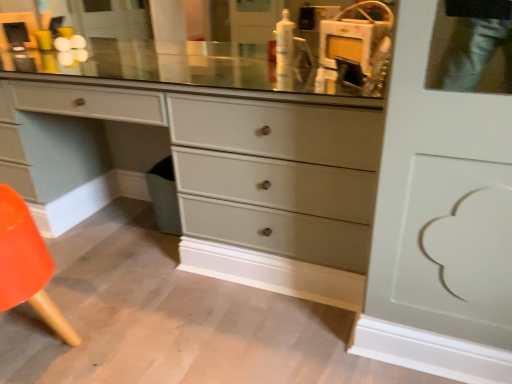
Image resolution: width=512 pixels, height=384 pixels. Identify the location of matte gray dresser at center. (249, 180).

You are a GUI agent. You are given a task and a screenshot of the screen. Output one action in this format:
    pyautogui.click(x=<x>, y=<y>)
    Task: Click on the orange plastic chair at lower left
    
    Given the screenshot: What is the action you would take?
    pyautogui.click(x=27, y=265)

This screenshot has height=384, width=512. I want to click on matte gray dresser at center, so click(249, 180).

Is matte gray dresser at center directly adjacent to white glossy lotion at upper center?

matte gray dresser at center and white glossy lotion at upper center are clearly separated.

The image size is (512, 384). Identify the location of chest of drawers that is on the left side of white glossy lotion at upper center. (249, 180).

Does point (147, 144) appear closer or farther from the camera than point (283, 11)?

Point (147, 144) is positioned closer to the camera compared to point (283, 11).

Is matte gray dresser at center oriented away from white glossy lotion at upper center?

matte gray dresser at center is not turned away from white glossy lotion at upper center.

Which is more to the right, white glossy lotion at upper center or matte gray dresser at center?

Positioned to the right is white glossy lotion at upper center.

From a real-world perspective, relative to matte gray dresser at center, is white glossy lotion at upper center vertically above or below?

Clearly, from a real-world perspective, white glossy lotion at upper center is above matte gray dresser at center.

Based on the photo, between white glossy lotion at upper center and matte gray dresser at center, which one has less height?

With less height is white glossy lotion at upper center.

From the image's perspective, relative to matte gray dresser at center, is white glossy lotion at upper center above or below?

Based on their image positions, white glossy lotion at upper center is located above matte gray dresser at center.

From their relative heights in the image, would you say orange plastic chair at lower left is taller or shorter than matte gray dresser at center?

orange plastic chair at lower left is shorter than matte gray dresser at center.

Is the surface of orange plastic chair at lower left in direct contact with matte gray dresser at center?

No, orange plastic chair at lower left is not touching matte gray dresser at center.

From the image's perspective, is orange plastic chair at lower left located above or below matte gray dresser at center?

orange plastic chair at lower left is below matte gray dresser at center.

Is orange plastic chair at lower left inside the boundaries of matte gray dresser at center, or outside?

orange plastic chair at lower left lies outside matte gray dresser at center.

How different are the orientations of matte gray dresser at center and orange plastic chair at lower left in degrees?

176 degrees.

Can you confirm if matte gray dresser at center is wider than orange plastic chair at lower left?

Correct, the width of matte gray dresser at center exceeds that of orange plastic chair at lower left.

Considering the positions of point (341, 275) and point (30, 293), is point (341, 275) closer or farther from the camera than point (30, 293)?

Clearly, point (341, 275) is more distant from the camera than point (30, 293).

Between white glossy lotion at upper center and orange plastic chair at lower left, which one appears on the left side from the viewer's perspective?

orange plastic chair at lower left.

What's the angular difference between white glossy lotion at upper center and orange plastic chair at lower left's facing directions?

The angle between the facing direction of white glossy lotion at upper center and the facing direction of orange plastic chair at lower left is 173 degrees.

Do you think white glossy lotion at upper center is within orange plastic chair at lower left, or outside of it?

white glossy lotion at upper center is located beyond the bounds of orange plastic chair at lower left.

In terms of height, does white glossy lotion at upper center look taller or shorter compared to orange plastic chair at lower left?

In the image, white glossy lotion at upper center appears to be shorter than orange plastic chair at lower left.

From the image's perspective, is orange plastic chair at lower left positioned above or below white glossy lotion at upper center?

From the image's perspective, orange plastic chair at lower left appears below white glossy lotion at upper center.

Which of these two, orange plastic chair at lower left or white glossy lotion at upper center, stands taller?

orange plastic chair at lower left is taller.

Consider the image. How many degrees apart are the facing directions of orange plastic chair at lower left and white glossy lotion at upper center?

The angular difference between orange plastic chair at lower left and white glossy lotion at upper center is 173 degrees.

From a real-world perspective, is orange plastic chair at lower left positioned above or below white glossy lotion at upper center?

From a real-world perspective, orange plastic chair at lower left is physically below white glossy lotion at upper center.

Where is `the chest of drawers that appears below the white glossy lotion at upper center (from the image's perspective)`? Image resolution: width=512 pixels, height=384 pixels. the chest of drawers that appears below the white glossy lotion at upper center (from the image's perspective) is located at coordinates (249, 180).

Image resolution: width=512 pixels, height=384 pixels. Find the location of `toiletry above the matte gray dresser at center (from a real-world perspective)`. toiletry above the matte gray dresser at center (from a real-world perspective) is located at coordinates pos(284,51).

Which object lies nearer to the anchor point orange plastic chair at lower left, matte gray dresser at center or white glossy lotion at upper center?

matte gray dresser at center lies closer to orange plastic chair at lower left than the other object.

Based on their spatial positions, is white glossy lotion at upper center or orange plastic chair at lower left closer to matte gray dresser at center?

Among the two, white glossy lotion at upper center is located nearer to matte gray dresser at center.

Looking at the image, which one is located closer to matte gray dresser at center, orange plastic chair at lower left or white glossy lotion at upper center?

white glossy lotion at upper center is closer to matte gray dresser at center.

Which object lies further to the anchor point orange plastic chair at lower left, white glossy lotion at upper center or matte gray dresser at center?

The object further to orange plastic chair at lower left is white glossy lotion at upper center.

From the image, which object appears to be nearer to white glossy lotion at upper center, matte gray dresser at center or orange plastic chair at lower left?

matte gray dresser at center lies closer to white glossy lotion at upper center than the other object.

Based on their spatial positions, is orange plastic chair at lower left or matte gray dresser at center further from white glossy lotion at upper center?

orange plastic chair at lower left lies further to white glossy lotion at upper center than the other object.

Where is `chest of drawers between orange plastic chair at lower left and white glossy lotion at upper center in the horizontal direction`? This screenshot has width=512, height=384. chest of drawers between orange plastic chair at lower left and white glossy lotion at upper center in the horizontal direction is located at coordinates (249, 180).